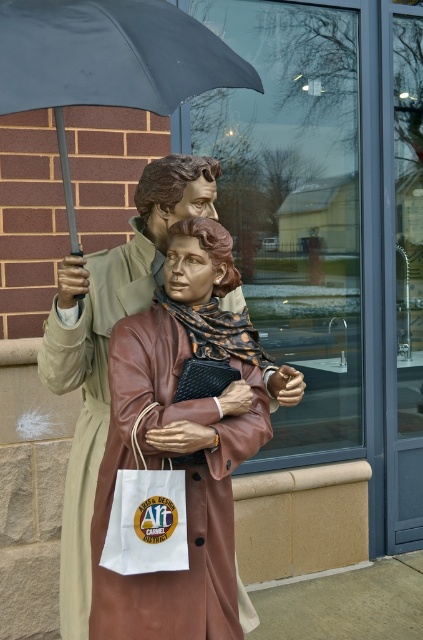
You are a maintenance worker tasked with cleaning the two statues. You have a 12 inch long cleaning tool. Can you reach from the matte brown leather coat at center to the matte black umbrella at upper center without moving the tool?

The distance between the matte brown leather coat at center and the matte black umbrella at upper center is 18.72 inches. Since your tool is only 12 inches long, you cannot reach from the matte brown leather coat at center to the matte black umbrella at upper center without moving the tool.

You are an artist planning to create a miniature version of the statue with the matte brown leather coat at center and the matte black umbrella at upper center. If you want the umbrella to be proportional to the coat in your model, which object should you scale down more when creating the miniature?

The matte brown leather coat at center is larger than the matte black umbrella at upper center, so to maintain proportion, you should scale down the matte brown leather coat at center more than the matte black umbrella at upper center in your miniature.

What is the 2D coordinate of the matte brown leather coat at center?

The 2D coordinate of the matte brown leather coat at center is at point (107, 346).